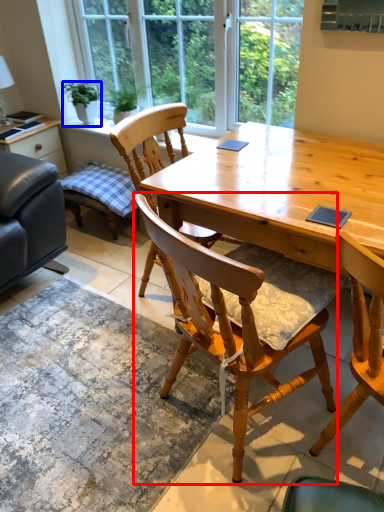
Question: Which object appears closest to the camera in this image, chair (highlighted by a red box) or houseplant (highlighted by a blue box)?

Choices:
 (A) chair
 (B) houseplant

Answer: (A)